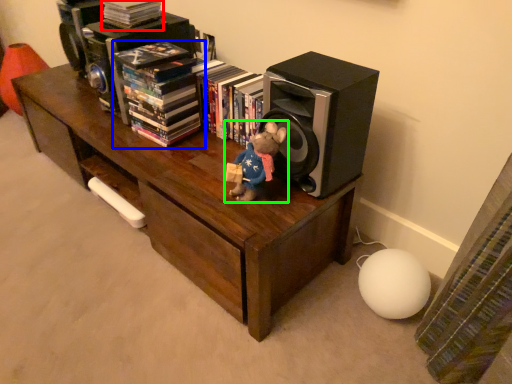
Question: Which object is positioned farthest from book (highlighted by a red box)? Select from book (highlighted by a blue box) and toy (highlighted by a green box).

Choices:
 (A) book
 (B) toy

Answer: (B)